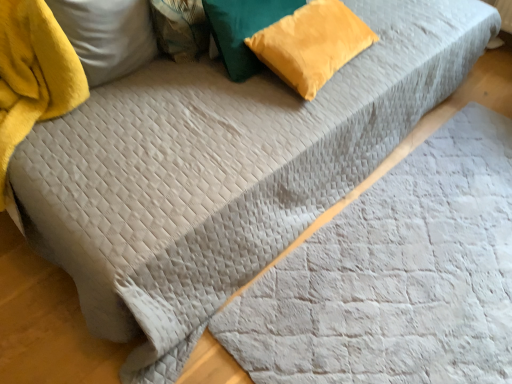
Question: From a real-world perspective, is velvet yellow pillow at upper center, the 2th pillow in the left-to-right sequence, on top of yellow velvet pillow at upper left, the third pillow viewed from the right?

Choices:
 (A) no
 (B) yes

Answer: (A)

Question: Considering the relative positions of velvet yellow pillow at upper center, the 2th pillow viewed from the right, and yellow velvet pillow at upper left, acting as the 1th pillow starting from the left, in the image provided, is velvet yellow pillow at upper center, the 2th pillow viewed from the right, in front of yellow velvet pillow at upper left, acting as the 1th pillow starting from the left,?

Choices:
 (A) no
 (B) yes

Answer: (A)

Question: From the image's perspective, is velvet yellow pillow at upper center, the 2th pillow in the left-to-right sequence, over yellow velvet pillow at upper left, the third pillow viewed from the right?

Choices:
 (A) no
 (B) yes

Answer: (B)

Question: Is the surface of velvet yellow pillow at upper center, the 2th pillow viewed from the right, in direct contact with yellow velvet pillow at upper left, the third pillow viewed from the right?

Choices:
 (A) yes
 (B) no

Answer: (B)

Question: Is velvet yellow pillow at upper center, the 2th pillow in the left-to-right sequence, positioned far away from yellow velvet pillow at upper left, acting as the 1th pillow starting from the left?

Choices:
 (A) no
 (B) yes

Answer: (A)

Question: From the image's perspective, is velvet yellow pillow at upper center, the 2th pillow in the left-to-right sequence, positioned above or below yellow velvet pillow at upper left, the third pillow viewed from the right?

Choices:
 (A) below
 (B) above

Answer: (B)

Question: From a real-world perspective, is velvet yellow pillow at upper center, the 2th pillow in the left-to-right sequence, above or below yellow velvet pillow at upper left, the third pillow viewed from the right?

Choices:
 (A) below
 (B) above

Answer: (A)

Question: Is velvet yellow pillow at upper center, the 2th pillow in the left-to-right sequence, wider or thinner than yellow velvet pillow at upper left, acting as the 1th pillow starting from the left?

Choices:
 (A) thin
 (B) wide

Answer: (A)

Question: Is velvet yellow pillow at upper center, the 2th pillow viewed from the right, situated inside yellow velvet pillow at upper left, the third pillow viewed from the right, or outside?

Choices:
 (A) outside
 (B) inside

Answer: (A)

Question: Is yellow velvet pillow at upper left, the third pillow viewed from the right, bigger or smaller than velvet yellow pillow at upper right, which is the first pillow from right to left?

Choices:
 (A) big
 (B) small

Answer: (A)

Question: Would you say yellow velvet pillow at upper left, the third pillow viewed from the right, is to the left or to the right of velvet yellow pillow at upper right, positioned as the third pillow in left-to-right order, in the picture?

Choices:
 (A) left
 (B) right

Answer: (A)

Question: Choose the correct answer: Is yellow velvet pillow at upper left, acting as the 1th pillow starting from the left, inside velvet yellow pillow at upper right, which is the first pillow from right to left, or outside it?

Choices:
 (A) inside
 (B) outside

Answer: (B)

Question: Considering the positions of yellow velvet pillow at upper left, the third pillow viewed from the right, and velvet yellow pillow at upper right, positioned as the third pillow in left-to-right order, in the image, is yellow velvet pillow at upper left, the third pillow viewed from the right, wider or thinner than velvet yellow pillow at upper right, positioned as the third pillow in left-to-right order,?

Choices:
 (A) thin
 (B) wide

Answer: (A)

Question: Relative to gray quilted blanket at center, is yellow velvet pillow at upper left, acting as the 1th pillow starting from the left, in front or behind?

Choices:
 (A) behind
 (B) front

Answer: (A)

Question: Does point (106, 39) appear closer or farther from the camera than point (487, 178)?

Choices:
 (A) farther
 (B) closer

Answer: (B)